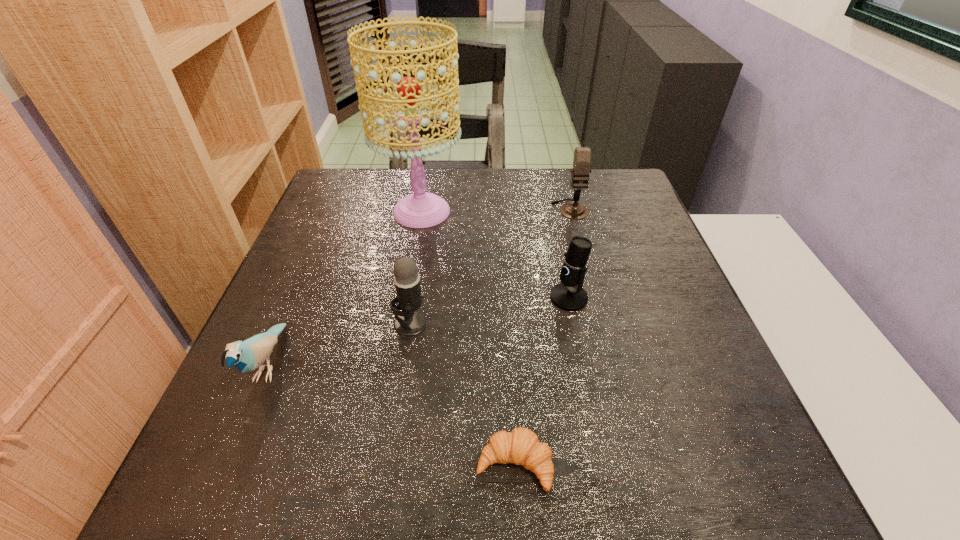
In order to click on lampshade in this screenshot , I will do `click(421, 209)`.

Find the location of a particular element. The width and height of the screenshot is (960, 540). the farthest microphone is located at coordinates (582, 155).

I want to click on the leftmost microphone, so click(x=409, y=322).

At what (x,y) coordinates should I click in order to perform the action: click on the leftmost object. Please return your answer as a coordinate pair (x, y). Looking at the image, I should click on (247, 355).

The image size is (960, 540). Find the location of `the third object from right to left`. the third object from right to left is located at coordinates (521, 446).

What are the coordinates of `the shortest object` in the screenshot? It's located at (521, 446).

What are the coordinates of `vacant space situated 0.260m on the right of the tallest object` in the screenshot? It's located at (559, 212).

Locate an element on the screen. This screenshot has height=540, width=960. vacant space located on the front-facing side of the farthest microphone is located at coordinates (579, 243).

The height and width of the screenshot is (540, 960). I want to click on vacant space situated on the left of the leftmost microphone, so click(262, 323).

Where is `free point located at the face of the leftmost object`? The image size is (960, 540). free point located at the face of the leftmost object is located at coordinates (212, 501).